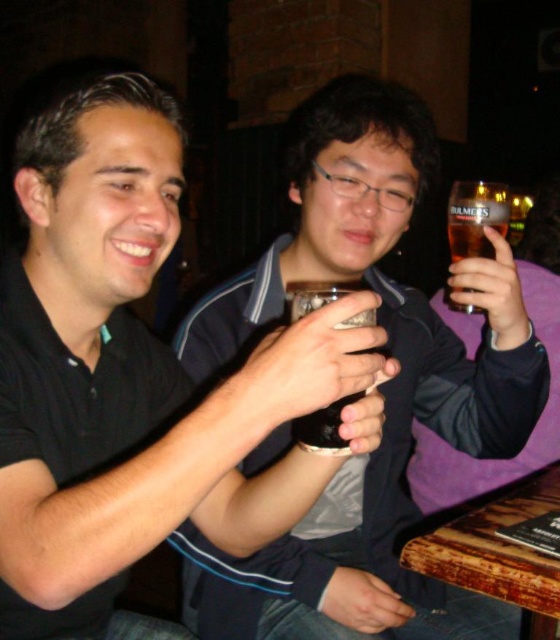
You are a waiter at the restaurant and need to deliver a drink to the customer. The customer is seated between the matte black mug at center and the clear glass mug at upper right. Which mug is closer to the customer?

The customer is seated between the matte black mug at center and the clear glass mug at upper right. Since the matte black mug at center is to the left of the clear glass mug at upper right, the customer is likely closer to the matte black mug at center.

What object is located at the coordinates point (380,387) in the image?

The point (380,387) indicates a matte glass mug at center.